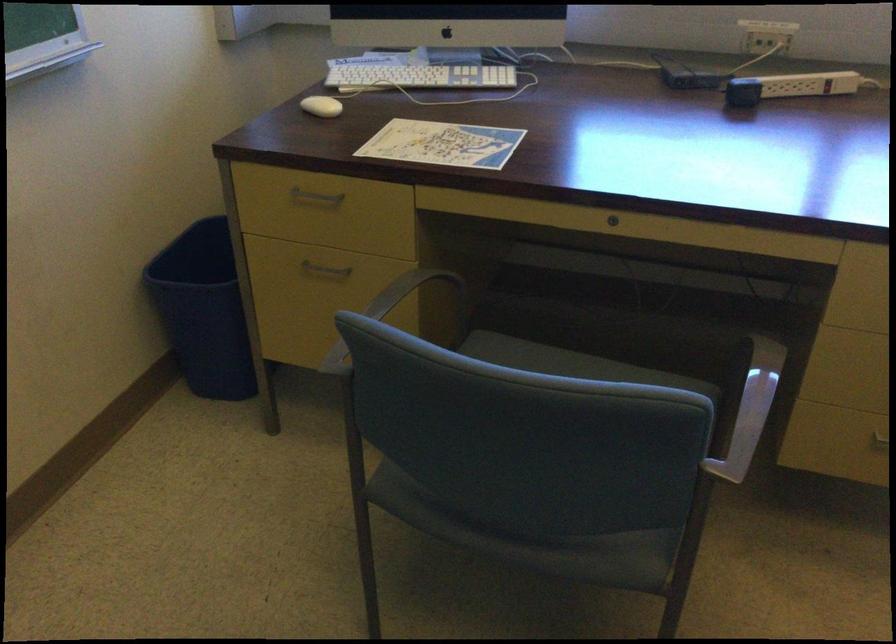
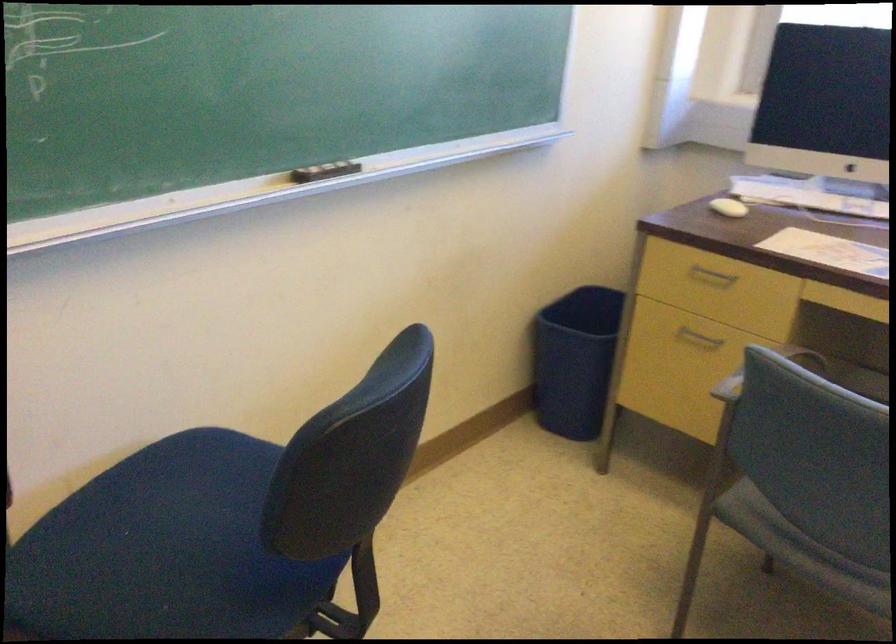
Locate, in the second image, the point that corresponds to the point at 199,323 in the first image.

(574, 360)